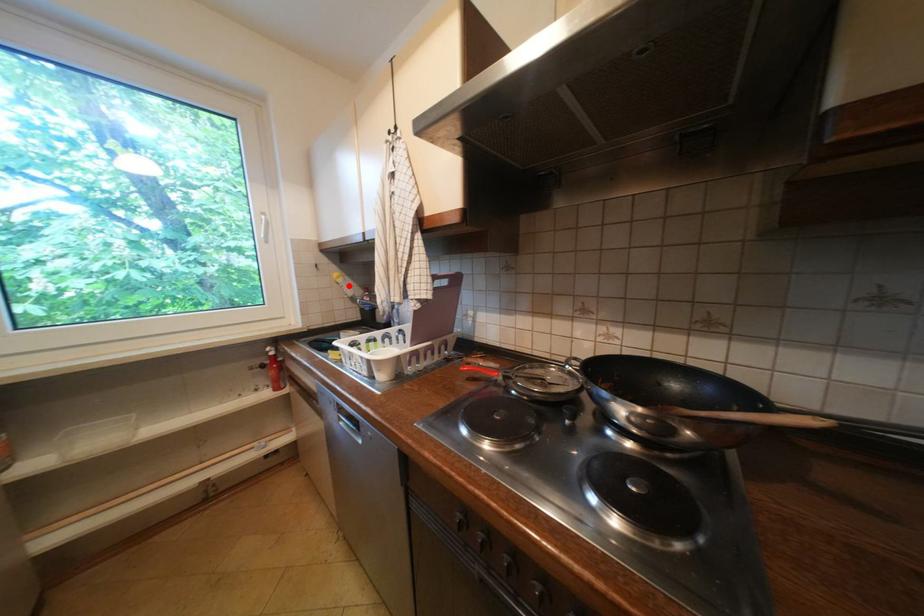
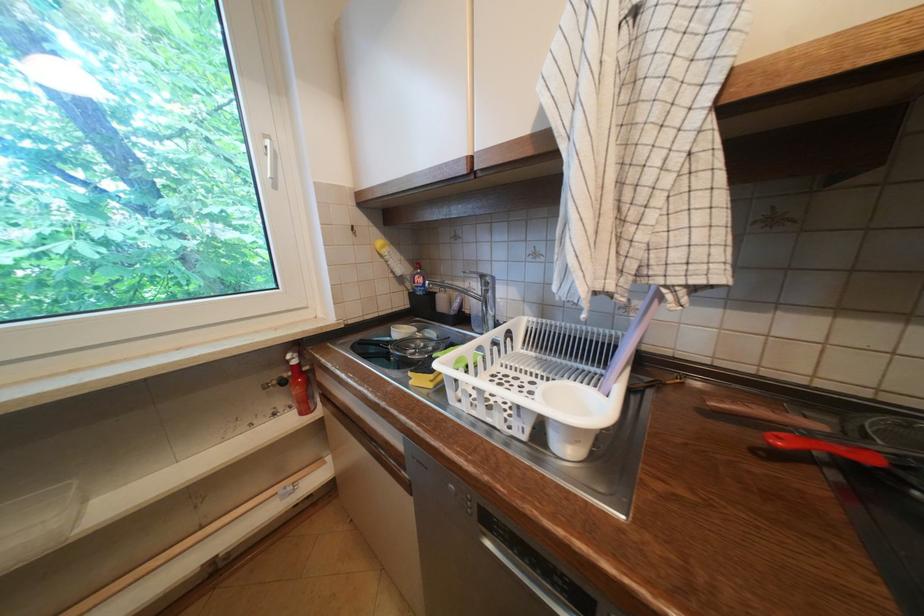
Find the pixel in the second image that matches the highlighted location in the first image.

(394, 259)